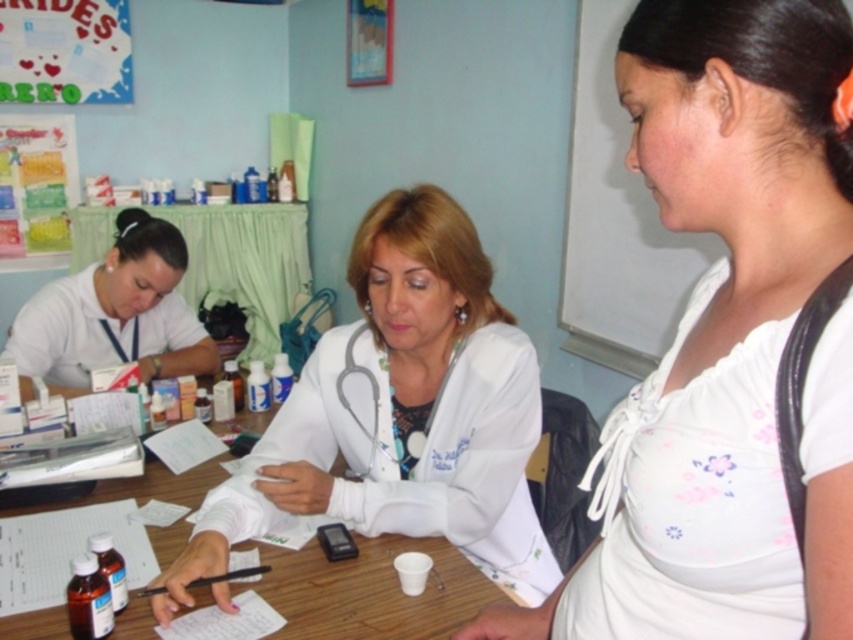
You are a patient in the clinic and need to locate two specific points marked in the image for a medical procedure. The first point is at coordinate point(103, 333) and the second at point(363, 372). Which point is closer to the healthcare professional seated at the table?

Point(103, 333) is behind point(363, 372), so the second point at point(363, 372) is closer to the healthcare professional seated at the table.

You are a patient in a clinic and you see both the white glossy stethoscope at upper left and the white fabric stethoscope at center. Which stethoscope is positioned higher up in the image?

→ The white glossy stethoscope at upper left is taller than the white fabric stethoscope at center, so it is positioned higher up in the image.

You are a patient entering the clinic and need to sit down. There is a wooden table at center and a white glossy stethoscope at upper left in the room. Which object is lower to the ground?

The wooden table at center is lower to the ground compared to the white glossy stethoscope at upper left as per the description.